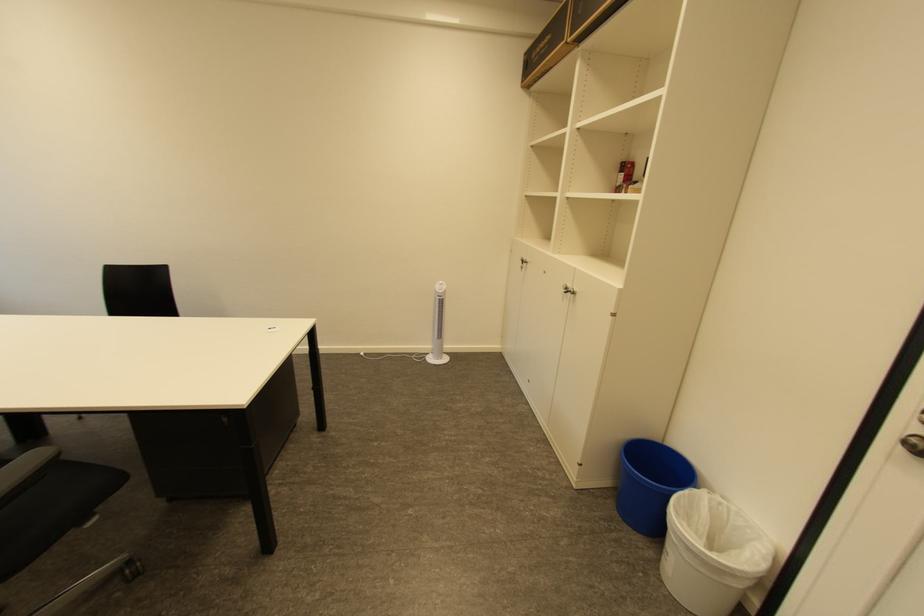
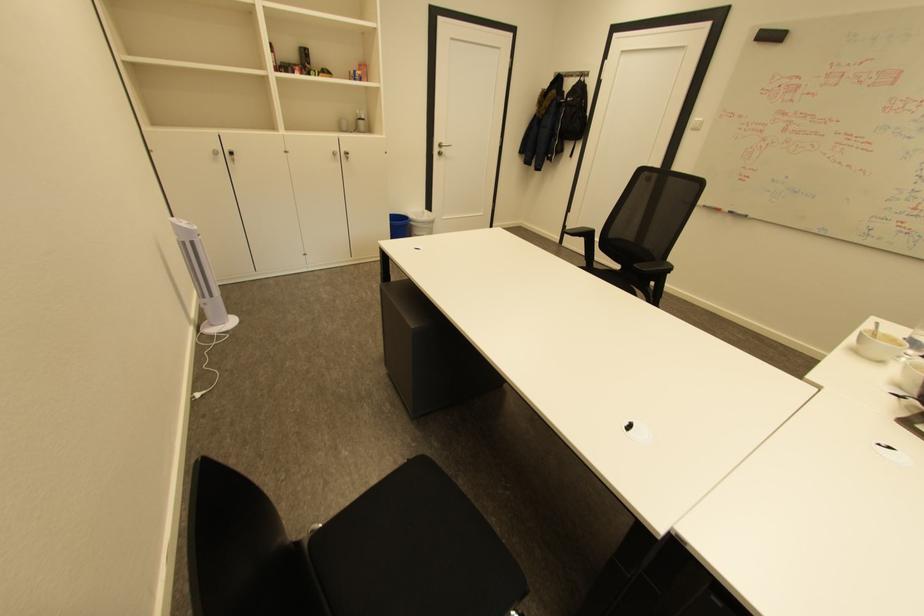
In the second image, find the point that corresponds to the point at 681,543 in the first image.

(432, 227)